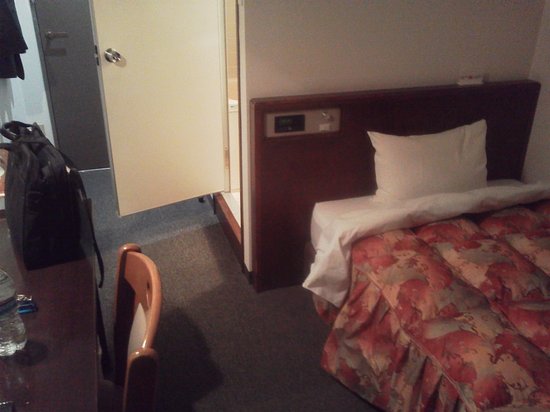
Where is `black door`? The image size is (550, 412). black door is located at coordinates (76, 52).